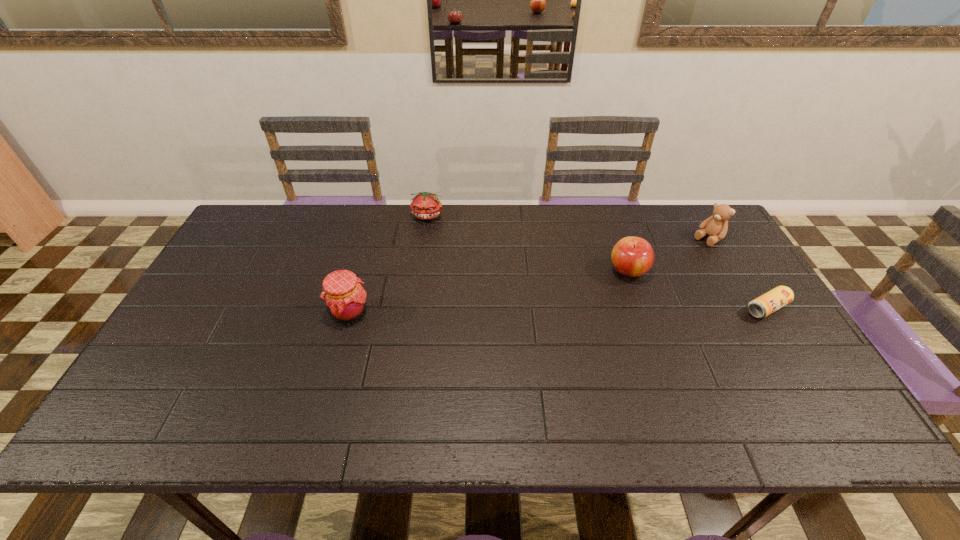
Locate an element on the screen. The width and height of the screenshot is (960, 540). free spot on the desktop that is between the jam and the shortest object and is positioned on the front-facing side of the farthest object is located at coordinates (496, 311).

What are the coordinates of `free space on the desktop that is between the jam and the beer can and is positioned on the stem of the third farthest object` in the screenshot? It's located at (552, 310).

The image size is (960, 540). In order to click on vacant space on the desktop that is between the leftmost object and the beer can and is positioned on the front-facing side of the teddy bear in this screenshot , I will do `click(613, 310)`.